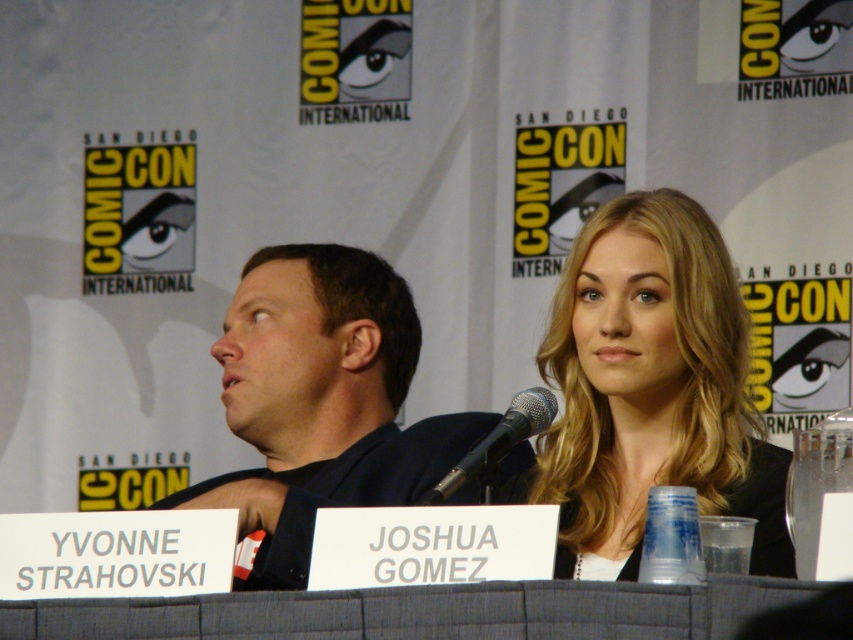
You are organizing a photo shoot and need to place a backdrop that can cover both the blonde hair at upper right and the dark blue shirt at left. Based on their positions and sizes, which object requires a wider coverage area?

The blonde hair at upper right might be wider than the dark blue shirt at left, so the backdrop should prioritize covering the area where the blonde hair at upper right is located to ensure full coverage.

You are an attendee at Comic Con and you want to take a photo of the dark blue shirt at left and the black metallic microphone at center. Can you see both clearly in the same frame?

The dark blue shirt at left is positioned over the black metallic microphone at center, so the dark blue shirt at left would block the view of the black metallic microphone at center, making it difficult to see both clearly in the same frame.

You are attending a panel at Comic Con and you want to know if the dark blue shirt at left is larger than the black metallic microphone at center. Can you confirm this?

The dark blue shirt at left is bigger than the black metallic microphone at center according to the description provided.